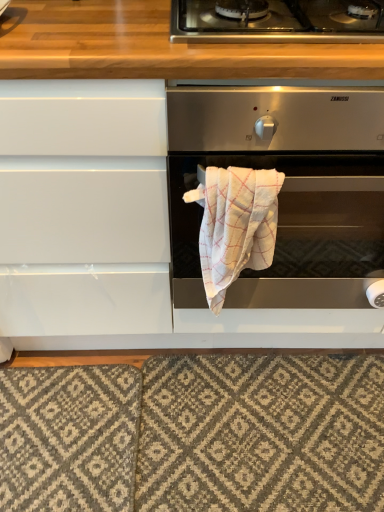
Question: Is point (264, 131) closer or farther from the camera than point (354, 397)?

Choices:
 (A) farther
 (B) closer

Answer: (B)

Question: From the image's perspective, is satin silver oven at center positioned above or below textured gray rug at lower center?

Choices:
 (A) below
 (B) above

Answer: (B)

Question: Estimate the real-world distances between objects in this image. Which object is closer to the white textured towel at center?

Choices:
 (A) textured gray rug at lower center
 (B) satin silver oven at center
 (C) stainless steel gas stove at upper center

Answer: (B)

Question: Considering the real-world distances, which object is farthest from the stainless steel gas stove at upper center?

Choices:
 (A) satin silver oven at center
 (B) textured gray rug at lower center
 (C) white textured towel at center

Answer: (B)